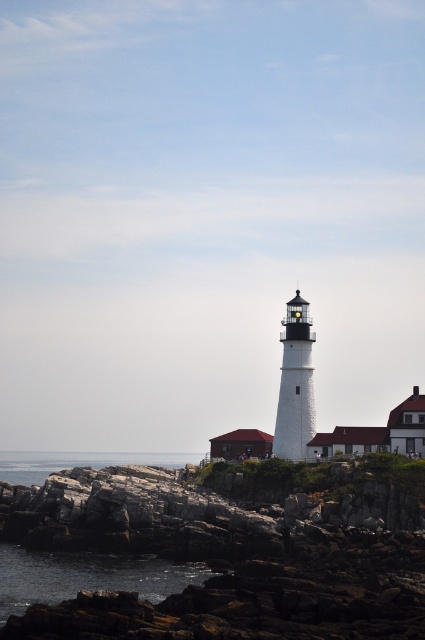
Question: In this image, where is dark water at lower left located relative to clear water at lower left?

Choices:
 (A) right
 (B) left

Answer: (A)

Question: Among these points, which one is nearest to the camera?

Choices:
 (A) coord(159,461)
 (B) coord(195,573)

Answer: (B)

Question: Which of the following is the farthest from the observer?

Choices:
 (A) (136, 461)
 (B) (101, 561)

Answer: (A)

Question: Which of the following is the farthest from the observer?

Choices:
 (A) dark water at lower left
 (B) clear water at lower left

Answer: (B)

Question: Is dark water at lower left positioned at the back of clear water at lower left?

Choices:
 (A) yes
 (B) no

Answer: (B)

Question: Is dark water at lower left in front of clear water at lower left?

Choices:
 (A) yes
 (B) no

Answer: (A)